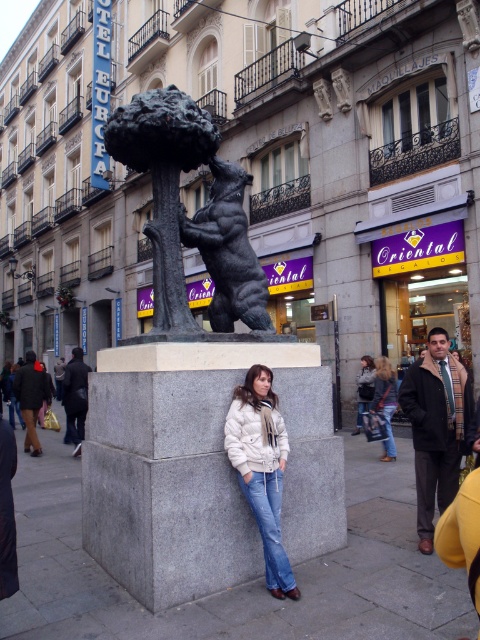
You are a delivery person carrying a package that requires a 6 feet distance from any obstacles. You need to place it between the bronze bear at center and the dark brown leather jacket at lower right. Is there enough space?

The bronze bear at center is 5.74 feet from dark brown leather jacket at lower right. Since the required distance is 6 feet, the space between them is insufficient for placing the package.

You are a pedestrian standing on the street looking at the sculpture. Can you see the white puffy jacket at center through the black polished stone bear at center?

The black polished stone bear at center is positioned over white puffy jacket at center, so the white puffy jacket at center is blocked by the bear and cannot be seen directly.

You are a photographer standing at the edge of the street. You want to take a photo of both the bronze bear at center and the denim jacket at lower right in the same frame. Which object should you focus on first if you want to ensure both are in focus?

The bronze bear at center has a lesser height compared to denim jacket at lower right, so you should focus on the bronze bear at center first to ensure both are in focus.